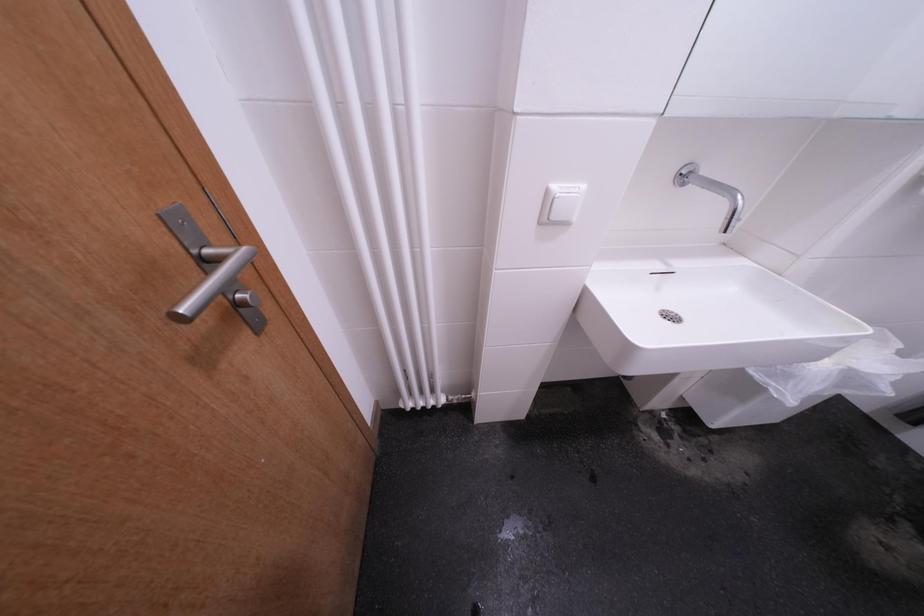
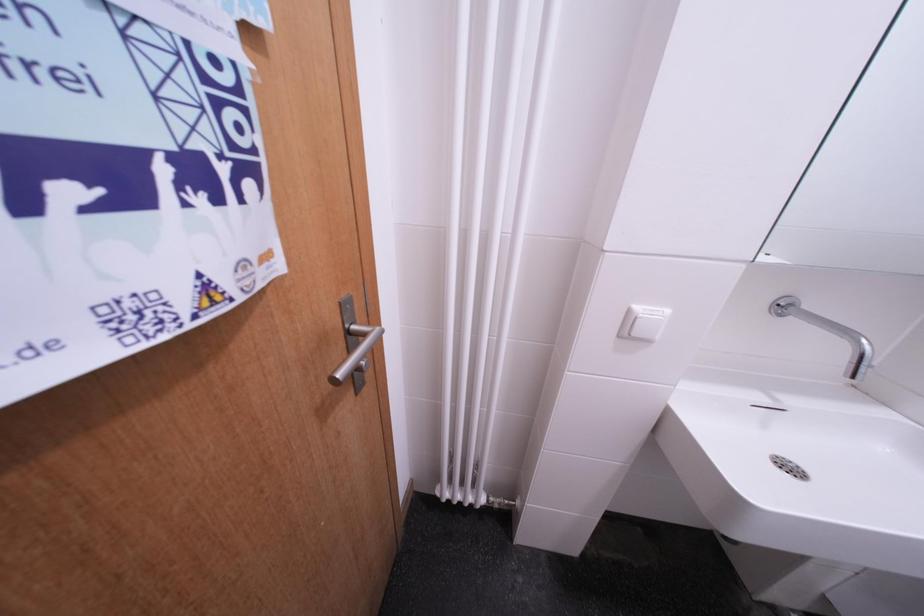
Question: The first image is from the beginning of the video and the second image is from the end. How did the camera likely rotate when shooting the video?

Choices:
 (A) Left
 (B) Right
 (C) Up
 (D) Down

Answer: (C)